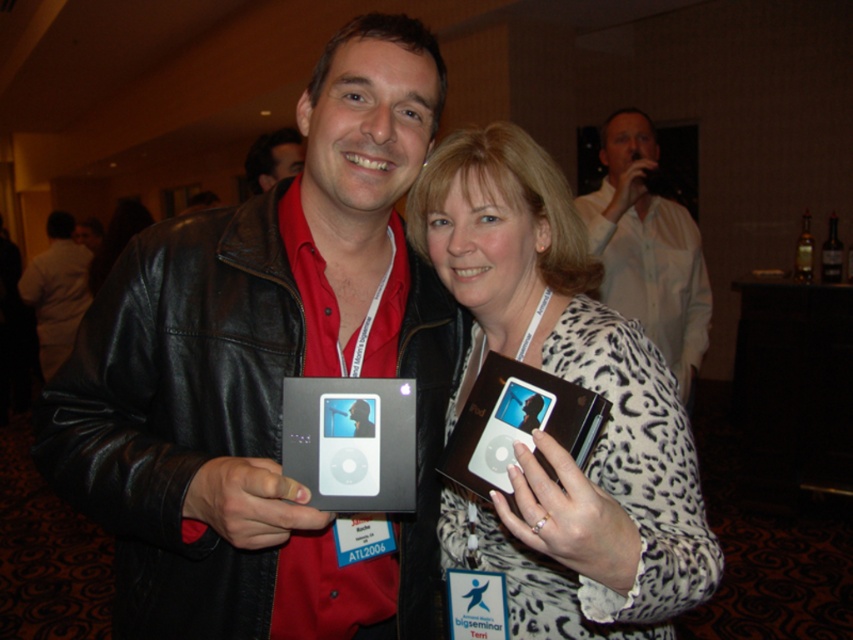
You are organizing a photo shoot and need to ensure that the white shirt at left and the dark brown leather jacket at upper center are framed properly. Which object is wider so that you can adjust the camera angle accordingly?

The white shirt at left is wider than the dark brown leather jacket at upper center, so you should adjust the camera angle to accommodate its width.

You are a photographer at a conference and need to capture a photo of both the black leather jacket at center and the satin brown ipod at center. Based on their positions, which object should you adjust your camera angle to focus on first to ensure both are in frame?

The black leather jacket at center is positioned on the left side of the satin brown ipod at center. Therefore, you should focus on the black leather jacket at center first to ensure both objects are included in the frame.

You are organizing a charity event and need to decide which of the two items, the white shirt at left or the dark brown leather jacket at upper center, can be displayed in a small showcase that can only accommodate items up to the size of the smaller object. Which item should you choose?

The dark brown leather jacket at upper center is smaller than the white shirt at left, so you should choose the dark brown leather jacket at upper center for the showcase.